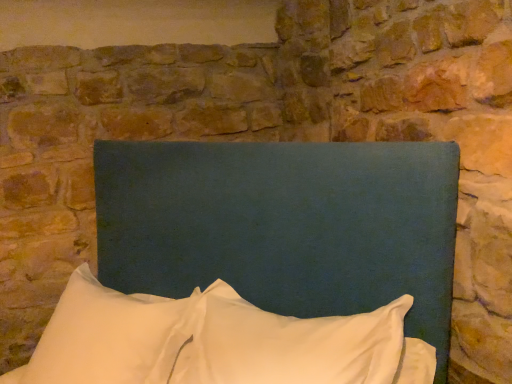
What do you see at coordinates (435, 167) in the screenshot? I see `teal fabric headboard at center` at bounding box center [435, 167].

Identify the location of teal fabric headboard at center. (435, 167).

How many degrees apart are the facing directions of white soft pillow at lower left, arranged as the first pillow when viewed from the left, and teal fabric headboard at center?

The angular difference between white soft pillow at lower left, arranged as the first pillow when viewed from the left, and teal fabric headboard at center is 2.49 degrees.

From a real-world perspective, is white soft pillow at lower left, which is counted as the 2th pillow, starting from the right, positioned over teal fabric headboard at center based on gravity?

No, from a real-world perspective, white soft pillow at lower left, which is counted as the 2th pillow, starting from the right, is not over teal fabric headboard at center

Considering the positions of objects white soft pillow at lower left, which is counted as the 2th pillow, starting from the right, and teal fabric headboard at center in the image provided, who is more to the right, white soft pillow at lower left, which is counted as the 2th pillow, starting from the right, or teal fabric headboard at center?

Positioned to the right is teal fabric headboard at center.

From the image's perspective, which one is positioned higher, white soft pillow at lower left, which is counted as the 2th pillow, starting from the right, or teal fabric headboard at center?

teal fabric headboard at center.

Where is `pillow located above the white soft pillow at lower left, arranged as the first pillow when viewed from the left (from the image's perspective)`? Image resolution: width=512 pixels, height=384 pixels. pillow located above the white soft pillow at lower left, arranged as the first pillow when viewed from the left (from the image's perspective) is located at coordinates (216, 342).

Considering the sizes of objects white soft pillow at lower left, arranged as the first pillow when viewed from the left, and white soft pillow at center, the 2th pillow when ordered from left to right, in the image provided, who is thinner, white soft pillow at lower left, arranged as the first pillow when viewed from the left, or white soft pillow at center, the 2th pillow when ordered from left to right,?

white soft pillow at center, the 2th pillow when ordered from left to right, is thinner.

Is white soft pillow at lower left, arranged as the first pillow when viewed from the left, facing away from white soft pillow at center, the 2th pillow when ordered from left to right?

white soft pillow at lower left, arranged as the first pillow when viewed from the left, does not have its back to white soft pillow at center, the 2th pillow when ordered from left to right.

Would you say white soft pillow at lower left, which is counted as the 2th pillow, starting from the right, is to the left or to the right of white soft pillow at center, which is the first pillow from right to left, in the picture?

white soft pillow at lower left, which is counted as the 2th pillow, starting from the right, is positioned on white soft pillow at center, which is the first pillow from right to left,'s left side.

Is the depth of white soft pillow at center, which is the first pillow from right to left, less than that of teal fabric headboard at center?

No, the depth of white soft pillow at center, which is the first pillow from right to left, is greater than that of teal fabric headboard at center.

From a real-world perspective, relative to teal fabric headboard at center, is white soft pillow at center, the 2th pillow when ordered from left to right, vertically above or below?

white soft pillow at center, the 2th pillow when ordered from left to right, is below teal fabric headboard at center.

Are white soft pillow at center, which is the first pillow from right to left, and teal fabric headboard at center located far from each other?

white soft pillow at center, which is the first pillow from right to left, is actually quite close to teal fabric headboard at center.

I want to click on bed on the left of white soft pillow at center, which is the first pillow from right to left, so click(x=435, y=167).

Does teal fabric headboard at center have a smaller size compared to white soft pillow at center, which is the first pillow from right to left?

Incorrect, teal fabric headboard at center is not smaller in size than white soft pillow at center, which is the first pillow from right to left.

Considering the sizes of objects teal fabric headboard at center and white soft pillow at center, the 2th pillow when ordered from left to right, in the image provided, who is wider, teal fabric headboard at center or white soft pillow at center, the 2th pillow when ordered from left to right,?

With larger width is teal fabric headboard at center.

Is teal fabric headboard at center next to white soft pillow at center, the 2th pillow when ordered from left to right?

There is a gap between teal fabric headboard at center and white soft pillow at center, the 2th pillow when ordered from left to right.

From a real-world perspective, is teal fabric headboard at center on top of white soft pillow at center, the 2th pillow when ordered from left to right?

Yes, from a real-world perspective, teal fabric headboard at center is above white soft pillow at center, the 2th pillow when ordered from left to right.

How different are the orientations of teal fabric headboard at center and white soft pillow at lower left, which is counted as the 2th pillow, starting from the right, in degrees?

The facing directions of teal fabric headboard at center and white soft pillow at lower left, which is counted as the 2th pillow, starting from the right, are 2.49 degrees apart.

Does point (446, 193) appear closer or farther from the camera than point (61, 343)?

Point (446, 193).

Are teal fabric headboard at center and white soft pillow at lower left, arranged as the first pillow when viewed from the left, located far from each other?

No, teal fabric headboard at center is in close proximity to white soft pillow at lower left, arranged as the first pillow when viewed from the left.

Looking at this image, from a real-world perspective, is teal fabric headboard at center on top of white soft pillow at lower left, which is counted as the 2th pillow, starting from the right?

Yes, from a real-world perspective, teal fabric headboard at center is above white soft pillow at lower left, which is counted as the 2th pillow, starting from the right.

Is white soft pillow at center, the 2th pillow when ordered from left to right, next to white soft pillow at lower left, arranged as the first pillow when viewed from the left, and touching it?

Yes, white soft pillow at center, the 2th pillow when ordered from left to right, is in contact with white soft pillow at lower left, arranged as the first pillow when viewed from the left.

Find the location of a particular element. The height and width of the screenshot is (384, 512). pillow located in front of the white soft pillow at lower left, arranged as the first pillow when viewed from the left is located at coordinates (216, 342).

From a real-world perspective, which object stands above the other?

white soft pillow at center, which is the first pillow from right to left, from a real-world perspective.

Find the location of a particular element. pillow that is the 2nd one when counting backward from the teal fabric headboard at center is located at coordinates click(106, 337).

Find the location of `pillow that is on the right side of white soft pillow at lower left, arranged as the first pillow when viewed from the left`. pillow that is on the right side of white soft pillow at lower left, arranged as the first pillow when viewed from the left is located at coordinates (216, 342).

Estimate the real-world distances between objects in this image. Which object is further from white soft pillow at center, which is the first pillow from right to left, white soft pillow at lower left, which is counted as the 2th pillow, starting from the right, or teal fabric headboard at center?

Among the two, teal fabric headboard at center is located further to white soft pillow at center, which is the first pillow from right to left.

Which object lies further to the anchor point teal fabric headboard at center, white soft pillow at lower left, arranged as the first pillow when viewed from the left, or white soft pillow at center, which is the first pillow from right to left?

Among the two, white soft pillow at lower left, arranged as the first pillow when viewed from the left, is located further to teal fabric headboard at center.

Which object lies nearer to the anchor point white soft pillow at center, the 2th pillow when ordered from left to right, teal fabric headboard at center or white soft pillow at lower left, which is counted as the 2th pillow, starting from the right?

white soft pillow at lower left, which is counted as the 2th pillow, starting from the right, is positioned closer to the anchor white soft pillow at center, the 2th pillow when ordered from left to right.

When comparing their distances from white soft pillow at lower left, arranged as the first pillow when viewed from the left, does teal fabric headboard at center or white soft pillow at center, the 2th pillow when ordered from left to right, seem further?

teal fabric headboard at center.

From the image, which object appears to be farther from white soft pillow at lower left, arranged as the first pillow when viewed from the left, white soft pillow at center, the 2th pillow when ordered from left to right, or teal fabric headboard at center?

teal fabric headboard at center lies further to white soft pillow at lower left, arranged as the first pillow when viewed from the left, than the other object.

When comparing their distances from teal fabric headboard at center, does white soft pillow at center, which is the first pillow from right to left, or white soft pillow at lower left, arranged as the first pillow when viewed from the left, seem closer?

Based on the image, white soft pillow at center, which is the first pillow from right to left, appears to be nearer to teal fabric headboard at center.

Locate an element on the screen. The image size is (512, 384). pillow positioned between teal fabric headboard at center and white soft pillow at lower left, arranged as the first pillow when viewed from the left, from near to far is located at coordinates (216, 342).